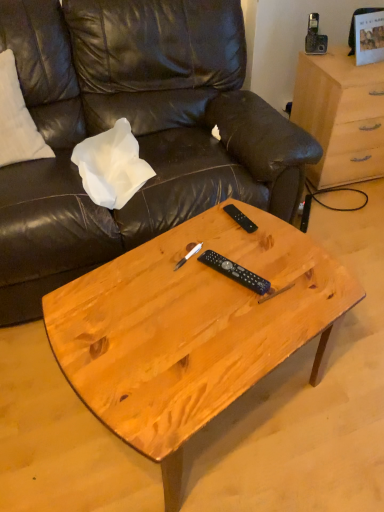
This screenshot has width=384, height=512. I want to click on free space to the back side of black plastic remote at center, acting as the 2th remote starting from the top, so click(229, 239).